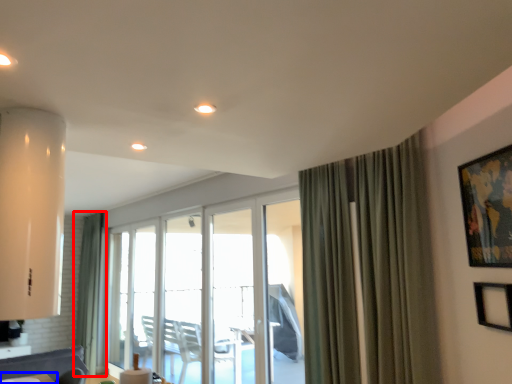
Question: Which object appears closest to the camera in this image, curtain (highlighted by a red box) or table (highlighted by a blue box)?

Choices:
 (A) curtain
 (B) table

Answer: (B)